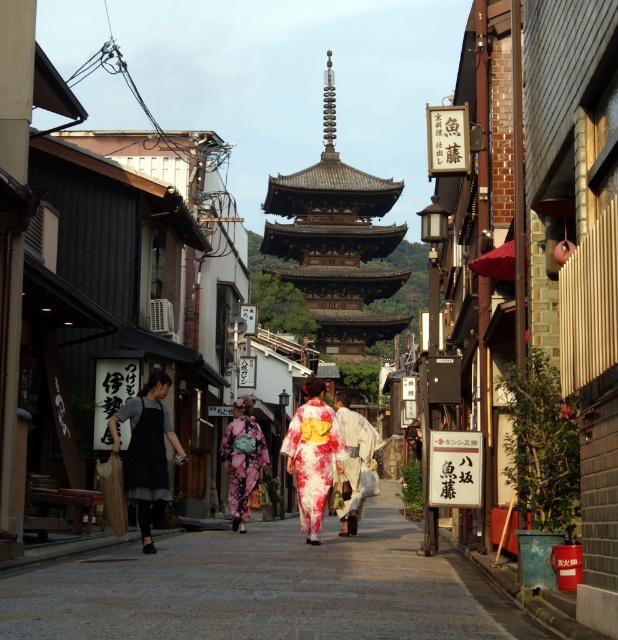
Question: Among these objects, which one is farthest from the camera?

Choices:
 (A) wooden pagoda at center
 (B) floral kimono at center
 (C) floral silk kimono at center
 (D) dark gray apron at left

Answer: (A)

Question: Does wooden pagoda at center have a larger size compared to dark gray apron at left?

Choices:
 (A) no
 (B) yes

Answer: (B)

Question: Is dark gray apron at left to the left of floral kimono at center from the viewer's perspective?

Choices:
 (A) yes
 (B) no

Answer: (A)

Question: Which object is the farthest from the dark gray apron at left?

Choices:
 (A) floral silk kimono at center
 (B) wooden pagoda at center
 (C) floral kimono at center

Answer: (B)

Question: Is wooden pagoda at center thinner than floral silk kimono at center?

Choices:
 (A) no
 (B) yes

Answer: (A)

Question: Which of the following is the closest to the observer?

Choices:
 (A) (289, 420)
 (B) (243, 458)
 (C) (133, 413)

Answer: (C)